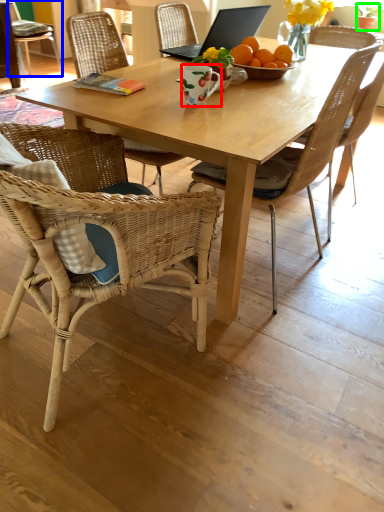
Question: Considering the real-world distances, which object is closest to coffee cup (highlighted by a red box)? chair (highlighted by a blue box) or houseplant (highlighted by a green box).

Choices:
 (A) chair
 (B) houseplant

Answer: (B)